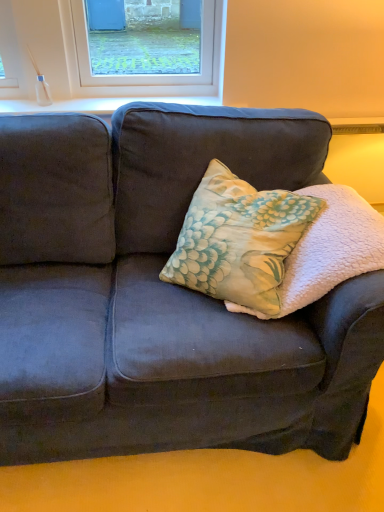
Where is `floral fabric pillow at center`? Image resolution: width=384 pixels, height=512 pixels. floral fabric pillow at center is located at coordinates (329, 250).

Measure the distance between floral fabric pillow at center and camera.

The distance of floral fabric pillow at center from camera is 1.13 meters.

Image resolution: width=384 pixels, height=512 pixels. Identify the location of white smooth window sill at upper center. (96, 104).

Identify the location of velvet dark blue couch at center. tap(162, 295).

At what (x,y) coordinates should I click in order to perform the action: click on floral fabric pillow at center. Please return your answer as a coordinate pair (x, y). This screenshot has width=384, height=512. Looking at the image, I should click on (329, 250).

Relative to white smooth window sill at upper center, is floral fabric pillow at center in front or behind?

Visually, floral fabric pillow at center is located in front of white smooth window sill at upper center.

Based on the photo, from a real-world perspective, is floral fabric pillow at center under white smooth window sill at upper center?

Indeed, from a real-world perspective, floral fabric pillow at center is positioned beneath white smooth window sill at upper center.

Which of these two, floral fabric pillow at center or white smooth window sill at upper center, is thinner?

white smooth window sill at upper center is thinner.

Considering the sizes of floral fabric pillow at center and white smooth window sill at upper center in the image, is floral fabric pillow at center taller or shorter than white smooth window sill at upper center?

Considering their sizes, floral fabric pillow at center has more height than white smooth window sill at upper center.

How distant is white smooth window sill at upper center from velvet dark blue couch at center?

A distance of 71.85 centimeters exists between white smooth window sill at upper center and velvet dark blue couch at center.

In terms of height, does white smooth window sill at upper center look taller or shorter compared to velvet dark blue couch at center?

In the image, white smooth window sill at upper center appears to be shorter than velvet dark blue couch at center.

Does white smooth window sill at upper center have a greater width compared to velvet dark blue couch at center?

No, white smooth window sill at upper center is not wider than velvet dark blue couch at center.

Considering the sizes of objects white smooth window sill at upper center and velvet dark blue couch at center in the image provided, who is smaller, white smooth window sill at upper center or velvet dark blue couch at center?

white smooth window sill at upper center.

Considering the relative positions of velvet dark blue couch at center and white smooth window sill at upper center in the image provided, is velvet dark blue couch at center to the left of white smooth window sill at upper center from the viewer's perspective?

In fact, velvet dark blue couch at center is to the right of white smooth window sill at upper center.

From a real-world perspective, who is located higher, velvet dark blue couch at center or white smooth window sill at upper center?

white smooth window sill at upper center, from a real-world perspective.

Which object is closer to the camera, velvet dark blue couch at center or white smooth window sill at upper center?

velvet dark blue couch at center is more forward.

From the image's perspective, is velvet dark blue couch at center located above white smooth window sill at upper center?

No.

Can you confirm if floral fabric pillow at center is bigger than floral fabric pillow at center?

Correct, floral fabric pillow at center is larger in size than floral fabric pillow at center.

Is floral fabric pillow at center positioned with its back to floral fabric pillow at center?

Correct, floral fabric pillow at center is looking away from floral fabric pillow at center.

Between point (334, 256) and point (199, 186), which one is positioned in front?

The point (334, 256) is more forward.

Based on their positions, is floral fabric pillow at center located to the left or right of floral fabric pillow at center?

In the image, floral fabric pillow at center appears on the right side of floral fabric pillow at center.

Is floral fabric pillow at center surrounding velvet dark blue couch at center?

No, velvet dark blue couch at center is not surrounded by floral fabric pillow at center.

Can you confirm if floral fabric pillow at center is positioned to the left of velvet dark blue couch at center?

No.

Is point (331, 245) positioned before point (19, 416)?

No, (331, 245) is further to viewer.

From the image's perspective, who appears lower, white smooth window sill at upper center or floral fabric pillow at center?

floral fabric pillow at center, from the image's perspective.

Considering the relative sizes of white smooth window sill at upper center and floral fabric pillow at center in the image provided, is white smooth window sill at upper center wider than floral fabric pillow at center?

No, white smooth window sill at upper center is not wider than floral fabric pillow at center.

Would you say floral fabric pillow at center is part of white smooth window sill at upper center's contents?

No, white smooth window sill at upper center does not contain floral fabric pillow at center.

How much distance is there between white smooth window sill at upper center and floral fabric pillow at center?

white smooth window sill at upper center is 27.31 inches from floral fabric pillow at center.

From the image's perspective, is floral fabric pillow at center below white smooth window sill at upper center?

Yes, from the image's perspective, floral fabric pillow at center is beneath white smooth window sill at upper center.

Which of these two, floral fabric pillow at center or white smooth window sill at upper center, stands shorter?

white smooth window sill at upper center.

Locate an element on the screen. This screenshot has width=384, height=512. window sill above the floral fabric pillow at center (from the image's perspective) is located at coordinates (96, 104).

Is floral fabric pillow at center outside of white smooth window sill at upper center?

floral fabric pillow at center is positioned outside white smooth window sill at upper center.

Find the location of `window sill above the floral fabric pillow at center (from a real-world perspective)`. window sill above the floral fabric pillow at center (from a real-world perspective) is located at coordinates [x=96, y=104].

Locate an element on the screen. Image resolution: width=384 pixels, height=512 pixels. studio couch located underneath the white smooth window sill at upper center (from a real-world perspective) is located at coordinates (162, 295).

Considering their positions, is floral fabric pillow at center positioned closer to white smooth window sill at upper center than velvet dark blue couch at center?

The object closer to white smooth window sill at upper center is floral fabric pillow at center.

Estimate the real-world distances between objects in this image. Which object is further from white smooth window sill at upper center, floral fabric pillow at center or floral fabric pillow at center?

floral fabric pillow at center lies further to white smooth window sill at upper center than the other object.

Based on their spatial positions, is floral fabric pillow at center or velvet dark blue couch at center further from floral fabric pillow at center?

The object further to floral fabric pillow at center is velvet dark blue couch at center.

Estimate the real-world distances between objects in this image. Which object is further from velvet dark blue couch at center, floral fabric pillow at center or white smooth window sill at upper center?

Among the two, white smooth window sill at upper center is located further to velvet dark blue couch at center.

Estimate the real-world distances between objects in this image. Which object is further from floral fabric pillow at center, velvet dark blue couch at center or floral fabric pillow at center?

The object further to floral fabric pillow at center is velvet dark blue couch at center.

Looking at the image, which one is located further to white smooth window sill at upper center, velvet dark blue couch at center or floral fabric pillow at center?

floral fabric pillow at center is further to white smooth window sill at upper center.

Considering their positions, is floral fabric pillow at center positioned closer to floral fabric pillow at center than white smooth window sill at upper center?

floral fabric pillow at center is closer to floral fabric pillow at center.

When comparing their distances from velvet dark blue couch at center, does floral fabric pillow at center or floral fabric pillow at center seem closer?

Based on the image, floral fabric pillow at center appears to be nearer to velvet dark blue couch at center.

Locate an element on the screen. The width and height of the screenshot is (384, 512). throw pillow positioned between floral fabric pillow at center and white smooth window sill at upper center from near to far is located at coordinates (238, 240).

Locate an element on the screen. pillow between white smooth window sill at upper center and velvet dark blue couch at center from top to bottom is located at coordinates (329, 250).

Find the location of a particular element. This screenshot has width=384, height=512. pillow that lies between floral fabric pillow at center and velvet dark blue couch at center from top to bottom is located at coordinates (329, 250).

Identify the location of throw pillow between white smooth window sill at upper center and velvet dark blue couch at center from top to bottom. The width and height of the screenshot is (384, 512). (238, 240).